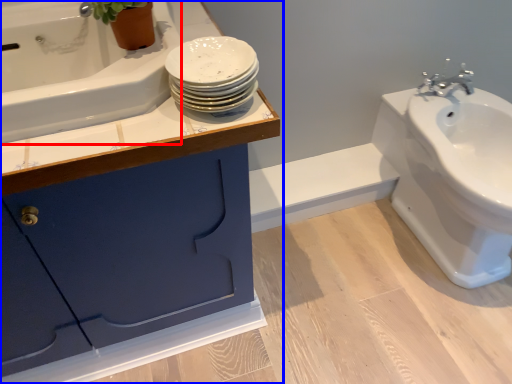
Question: Which object appears farthest to the camera in this image, bath (highlighted by a red box) or bathroom cabinet (highlighted by a blue box)?

Choices:
 (A) bath
 (B) bathroom cabinet

Answer: (B)